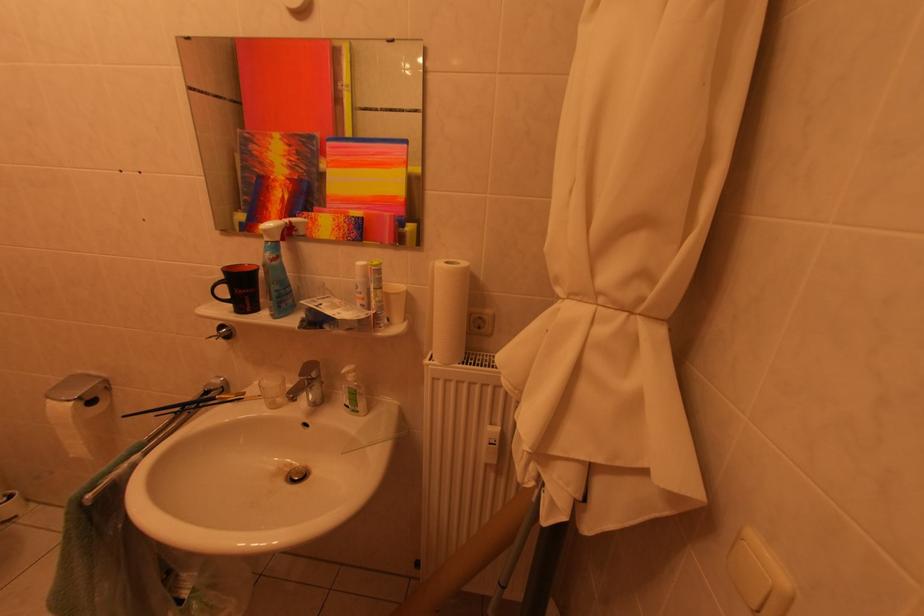
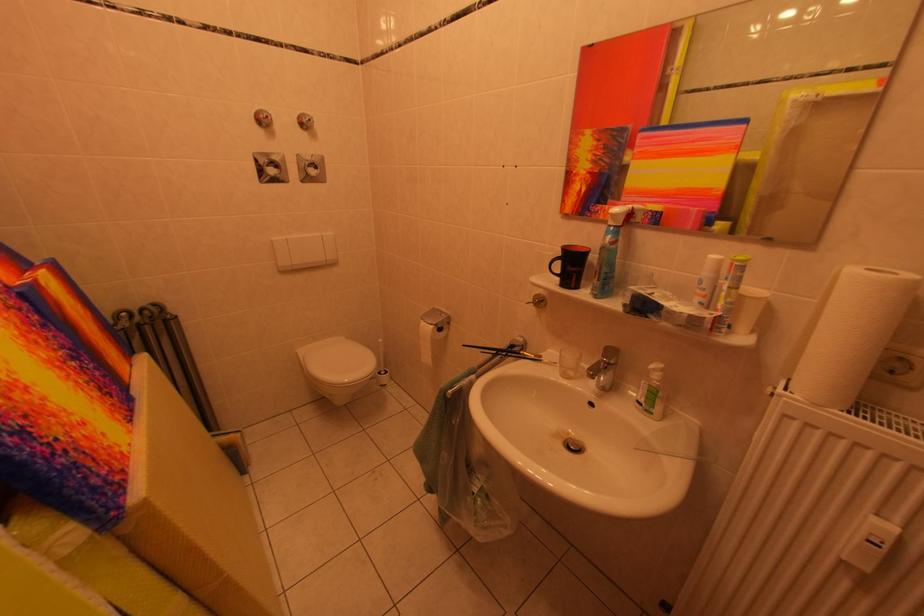
Locate, in the second image, the point that corresponds to point 442,363 in the first image.

(800, 397)